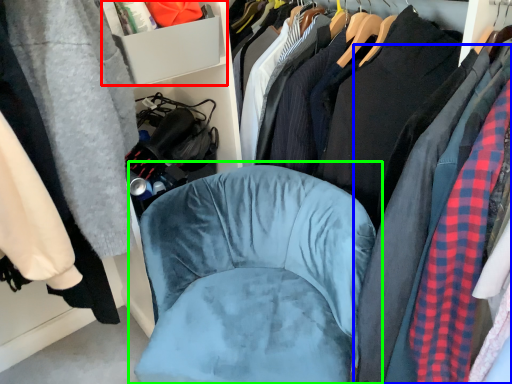
Question: Considering the real-world distances, which object is farthest from cabinet (highlighted by a red box)? clothing (highlighted by a blue box) or chair (highlighted by a green box)?

Choices:
 (A) clothing
 (B) chair

Answer: (A)